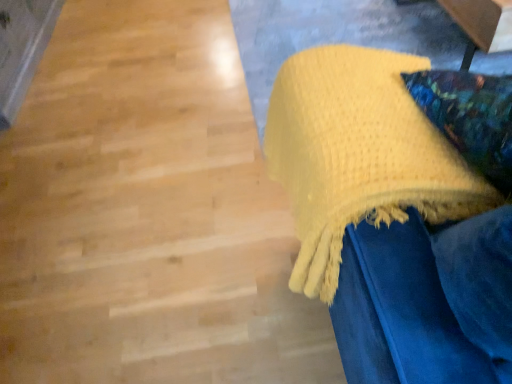
Find the location of a particular element. The image size is (512, 384). yellow knitted blanket at right is located at coordinates (359, 155).

The image size is (512, 384). What do you see at coordinates (359, 155) in the screenshot?
I see `yellow knitted blanket at right` at bounding box center [359, 155].

The image size is (512, 384). I want to click on yellow knitted blanket at right, so click(x=359, y=155).